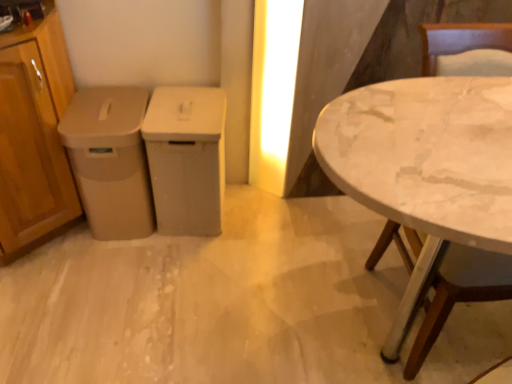
At what (x,y) coordinates should I click in order to perform the action: click on unoccupied region to the right of matte plastic trash can at center, the 3th cabinetry in the left-to-right sequence. Please return your answer as a coordinate pair (x, y). Looking at the image, I should click on (259, 216).